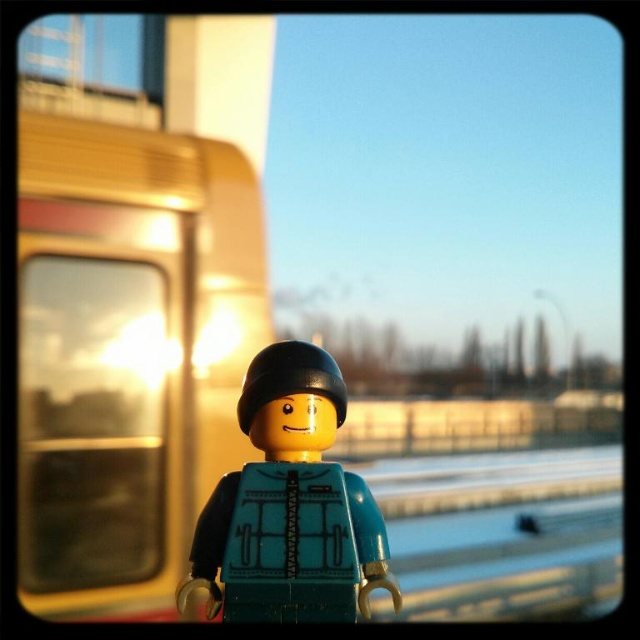
Question: Which of the following is the closest to the observer?

Choices:
 (A) transparent glass train window at left
 (B) matte teal plastic minifigure at center

Answer: (B)

Question: Does metallic gold train at left appear under transparent glass train window at left?

Choices:
 (A) no
 (B) yes

Answer: (A)

Question: Is metallic gold train at left behind transparent glass train window at left?

Choices:
 (A) no
 (B) yes

Answer: (A)

Question: Which point is closer to the camera?

Choices:
 (A) matte teal plastic minifigure at center
 (B) metallic gold train at left
 (C) transparent glass train window at left

Answer: (A)

Question: Which object is positioned closest to the matte teal plastic minifigure at center?

Choices:
 (A) transparent glass train window at left
 (B) metallic gold train at left

Answer: (A)

Question: Can you confirm if metallic gold train at left is thinner than matte teal plastic minifigure at center?

Choices:
 (A) yes
 (B) no

Answer: (B)